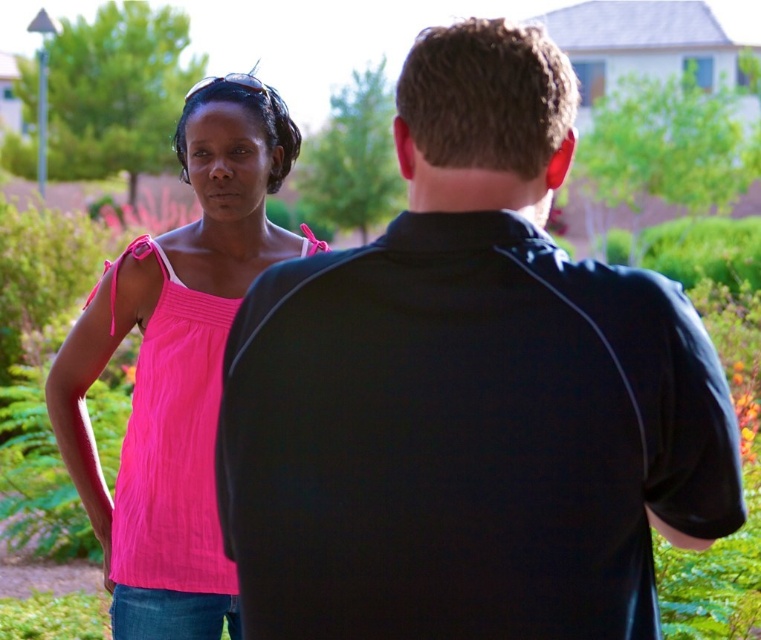
Between black matte shirt at center and matte pink tank top at left, which one has more height?

With more height is matte pink tank top at left.

Who is higher up, black matte shirt at center or matte pink tank top at left?

black matte shirt at center is above.

Between point (516, 138) and point (164, 560), which one is positioned in front?

Positioned in front is point (516, 138).

I want to click on black matte shirt at center, so click(x=470, y=392).

Does black matte shirt at center have a larger size compared to pink fabric top at left?

Incorrect, black matte shirt at center is not larger than pink fabric top at left.

Between black matte shirt at center and pink fabric top at left, which one is positioned lower?

black matte shirt at center is lower down.

Locate an element on the screen. Image resolution: width=761 pixels, height=640 pixels. black matte shirt at center is located at coordinates (470, 392).

The height and width of the screenshot is (640, 761). I want to click on black matte shirt at center, so click(470, 392).

Is the position of pink fabric top at left less distant than that of matte pink tank top at left?

Yes, pink fabric top at left is in front of matte pink tank top at left.

Can you confirm if pink fabric top at left is wider than matte pink tank top at left?

Correct, the width of pink fabric top at left exceeds that of matte pink tank top at left.

Does point (170, 285) lie in front of point (172, 461)?

No, (170, 285) is further to viewer.

Find the location of `pink fabric top at left`. pink fabric top at left is located at coordinates pos(177,365).